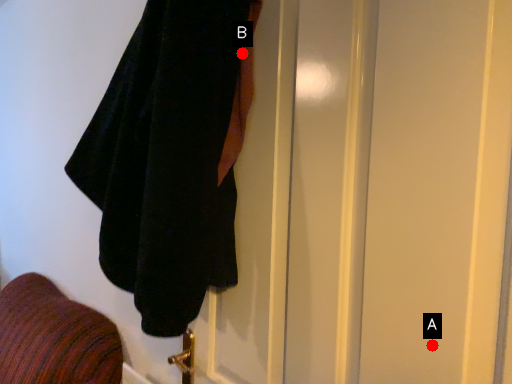
Question: Two points are circled on the image, labeled by A and B beside each circle. Which point is further to the camera?

Choices:
 (A) A is further
 (B) B is further

Answer: (B)